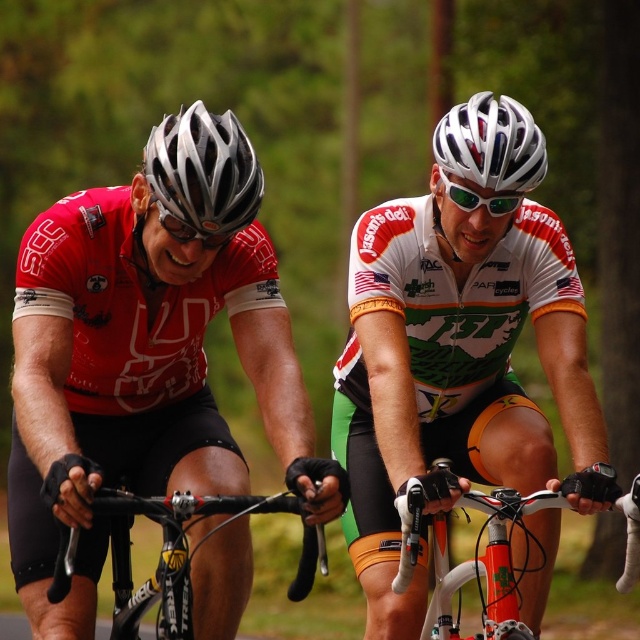
Does white glossy bicycle handlebars at center have a larger size compared to black matte bicycle handlebars at center?

Correct, white glossy bicycle handlebars at center is larger in size than black matte bicycle handlebars at center.

Image resolution: width=640 pixels, height=640 pixels. Describe the element at coordinates (509, 552) in the screenshot. I see `white glossy bicycle handlebars at center` at that location.

You are a GUI agent. You are given a task and a screenshot of the screen. Output one action in this format:
    pyautogui.click(x=<x>, y=<y>)
    Task: Click on the white glossy bicycle handlebars at center
    This screenshot has width=640, height=640.
    Given the screenshot: What is the action you would take?
    pyautogui.click(x=509, y=552)

Can you confirm if black matte bicycle handlebars at center is positioned to the left of shiny silver helmet at upper center?

Yes, black matte bicycle handlebars at center is to the left of shiny silver helmet at upper center.

Is black matte bicycle handlebars at center to the right of shiny silver helmet at upper center from the viewer's perspective?

Incorrect, black matte bicycle handlebars at center is not on the right side of shiny silver helmet at upper center.

This screenshot has width=640, height=640. What do you see at coordinates (188, 552) in the screenshot?
I see `black matte bicycle handlebars at center` at bounding box center [188, 552].

Identify the location of black matte bicycle handlebars at center. (188, 552).

What do you see at coordinates (204, 170) in the screenshot?
I see `silver matte bicycle helmet at upper left` at bounding box center [204, 170].

Is silver matte bicycle helmet at upper left to the right of shiny silver helmet at upper center from the viewer's perspective?

In fact, silver matte bicycle helmet at upper left is to the left of shiny silver helmet at upper center.

Locate an element on the screen. silver matte bicycle helmet at upper left is located at coordinates (204, 170).